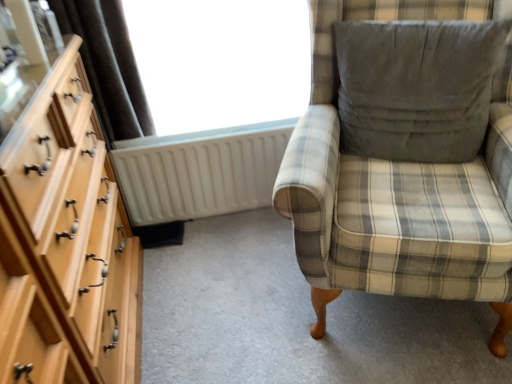
Question: From the image's perspective, does light wood dresser at left appear lower than gray suede pillow at upper right?

Choices:
 (A) no
 (B) yes

Answer: (B)

Question: Is light wood dresser at left far from gray suede pillow at upper right?

Choices:
 (A) no
 (B) yes

Answer: (B)

Question: Is light wood dresser at left wider than gray suede pillow at upper right?

Choices:
 (A) no
 (B) yes

Answer: (B)

Question: Can you confirm if light wood dresser at left is taller than gray suede pillow at upper right?

Choices:
 (A) yes
 (B) no

Answer: (A)

Question: Is light wood dresser at left positioned in front of gray suede pillow at upper right?

Choices:
 (A) yes
 (B) no

Answer: (A)

Question: Based on their sizes in the image, would you say light wood dresser at left is bigger or smaller than white plastic radiator at center?

Choices:
 (A) small
 (B) big

Answer: (B)

Question: Based on their positions, is light wood dresser at left located to the left or right of white plastic radiator at center?

Choices:
 (A) left
 (B) right

Answer: (A)

Question: Considering their positions, is light wood dresser at left located in front of or behind white plastic radiator at center?

Choices:
 (A) behind
 (B) front

Answer: (B)

Question: Considering the positions of point tap(100, 251) and point tap(202, 145), is point tap(100, 251) closer or farther from the camera than point tap(202, 145)?

Choices:
 (A) farther
 (B) closer

Answer: (B)

Question: Based on their sizes in the image, would you say white plastic radiator at center is bigger or smaller than light wood dresser at left?

Choices:
 (A) small
 (B) big

Answer: (A)

Question: In terms of width, does white plastic radiator at center look wider or thinner when compared to light wood dresser at left?

Choices:
 (A) thin
 (B) wide

Answer: (A)

Question: Would you say white plastic radiator at center is to the left or to the right of light wood dresser at left in the picture?

Choices:
 (A) left
 (B) right

Answer: (B)

Question: Considering the positions of point (288, 135) and point (82, 235), is point (288, 135) closer or farther from the camera than point (82, 235)?

Choices:
 (A) farther
 (B) closer

Answer: (A)

Question: Based on their sizes in the image, would you say transparent glass window at upper center is bigger or smaller than gray suede pillow at upper right?

Choices:
 (A) big
 (B) small

Answer: (A)

Question: From a real-world perspective, is transparent glass window at upper center above or below gray suede pillow at upper right?

Choices:
 (A) above
 (B) below

Answer: (A)